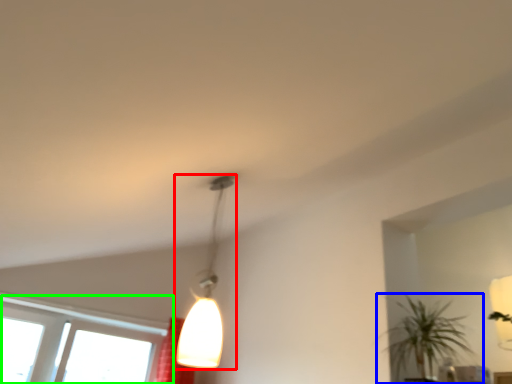
Question: Which object is positioned closest to lamp (highlighted by a red box)? Select from houseplant (highlighted by a blue box) and window (highlighted by a green box).

Choices:
 (A) houseplant
 (B) window

Answer: (A)